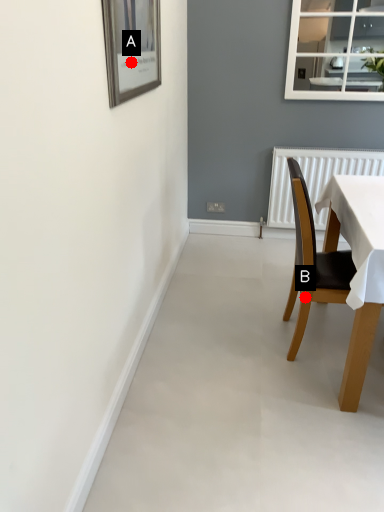
Question: Two points are circled on the image, labeled by A and B beside each circle. Which point appears closest to the camera in this image?

Choices:
 (A) A is closer
 (B) B is closer

Answer: (A)